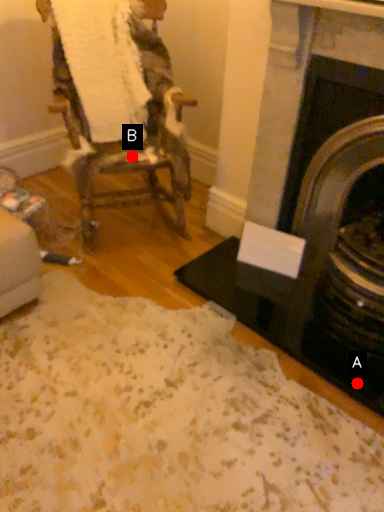
Question: Two points are circled on the image, labeled by A and B beside each circle. Which point is farther to the camera?

Choices:
 (A) A is further
 (B) B is further

Answer: (B)